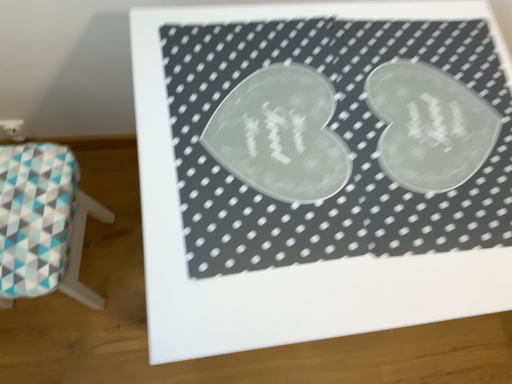
Question: Which direction should I rotate to look at transparent plastic bulletin board at center?

Choices:
 (A) right
 (B) left

Answer: (A)

Question: Is transparent plastic bulletin board at center positioned in front of teal and white fabric stool at lower left?

Choices:
 (A) yes
 (B) no

Answer: (A)

Question: Can you confirm if transparent plastic bulletin board at center is thinner than teal and white fabric stool at lower left?

Choices:
 (A) no
 (B) yes

Answer: (A)

Question: Can you confirm if transparent plastic bulletin board at center is taller than teal and white fabric stool at lower left?

Choices:
 (A) yes
 (B) no

Answer: (A)

Question: From a real-world perspective, is transparent plastic bulletin board at center located beneath teal and white fabric stool at lower left?

Choices:
 (A) no
 (B) yes

Answer: (A)

Question: Does transparent plastic bulletin board at center lie behind teal and white fabric stool at lower left?

Choices:
 (A) yes
 (B) no

Answer: (B)

Question: From the image's perspective, would you say transparent plastic bulletin board at center is positioned over teal and white fabric stool at lower left?

Choices:
 (A) no
 (B) yes

Answer: (B)

Question: From the image's perspective, would you say teal and white fabric stool at lower left is positioned over transparent plastic bulletin board at center?

Choices:
 (A) yes
 (B) no

Answer: (B)

Question: Considering the relative sizes of teal and white fabric stool at lower left and transparent plastic bulletin board at center in the image provided, is teal and white fabric stool at lower left smaller than transparent plastic bulletin board at center?

Choices:
 (A) yes
 (B) no

Answer: (A)

Question: Considering the relative sizes of teal and white fabric stool at lower left and transparent plastic bulletin board at center in the image provided, is teal and white fabric stool at lower left taller than transparent plastic bulletin board at center?

Choices:
 (A) no
 (B) yes

Answer: (A)

Question: Can transparent plastic bulletin board at center be found inside teal and white fabric stool at lower left?

Choices:
 (A) no
 (B) yes

Answer: (A)

Question: From a real-world perspective, does teal and white fabric stool at lower left sit lower than transparent plastic bulletin board at center?

Choices:
 (A) no
 (B) yes

Answer: (B)

Question: Is teal and white fabric stool at lower left bigger than transparent plastic bulletin board at center?

Choices:
 (A) no
 (B) yes

Answer: (A)

Question: Would you say transparent plastic bulletin board at center is inside or outside teal and white fabric stool at lower left?

Choices:
 (A) outside
 (B) inside

Answer: (A)